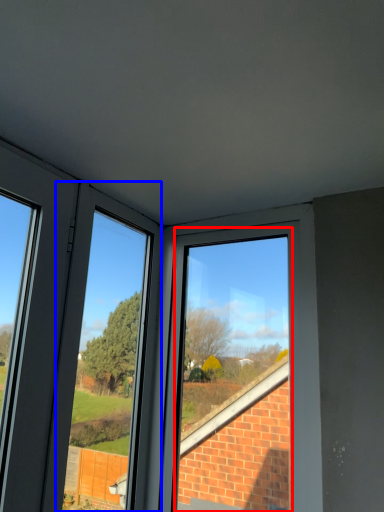
Question: Which object is closer to the camera taking this photo, bay window (highlighted by a red box) or window frame (highlighted by a blue box)?

Choices:
 (A) bay window
 (B) window frame

Answer: (B)